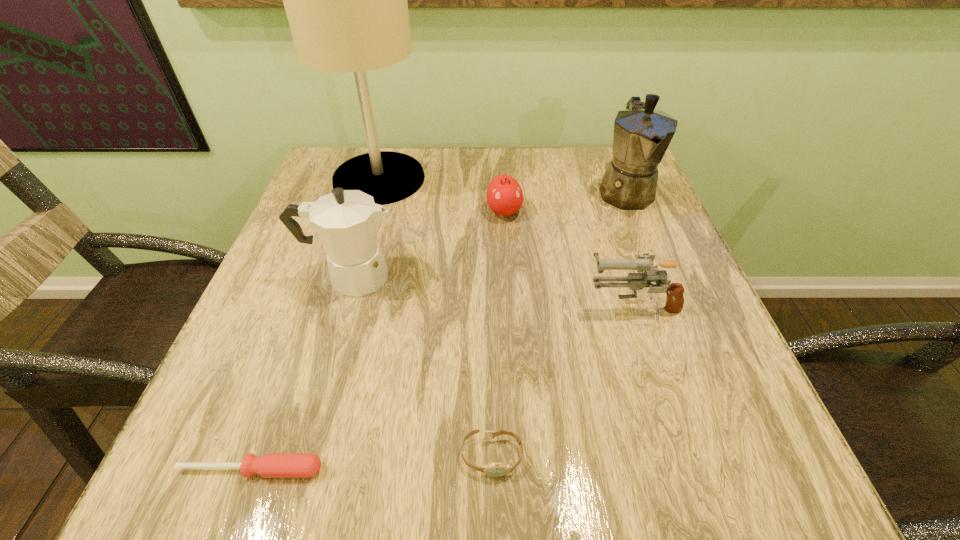
The height and width of the screenshot is (540, 960). I want to click on vacant space at the right edge of the desktop, so click(x=693, y=333).

The image size is (960, 540). What are the coordinates of `vacant space at the far left corner of the desktop` in the screenshot? It's located at (314, 194).

Find the location of a particular element. This screenshot has height=540, width=960. vacant area at the far right corner is located at coordinates (598, 181).

Where is `vacant region between the nearer coffeepot and the apple`? vacant region between the nearer coffeepot and the apple is located at coordinates (427, 244).

You are a GUI agent. You are given a task and a screenshot of the screen. Output one action in this format:
    pyautogui.click(x=<x>, y=<y>)
    Task: Click on the unoccupied position between the watch and the fourth tallest object
    This screenshot has width=960, height=540.
    Given the screenshot: What is the action you would take?
    pyautogui.click(x=562, y=380)

Identify the location of vacant area that lies between the watch and the tallest object. (436, 318).

Where is `free space between the gun and the shortest object`? The height and width of the screenshot is (540, 960). free space between the gun and the shortest object is located at coordinates (442, 387).

What are the coordinates of `free space between the shortest object and the table lamp` in the screenshot? It's located at (315, 325).

I want to click on free space between the screwdriver and the table lamp, so click(315, 325).

Identify the location of free spot between the fifth tallest object and the fourth shortest object. (568, 258).